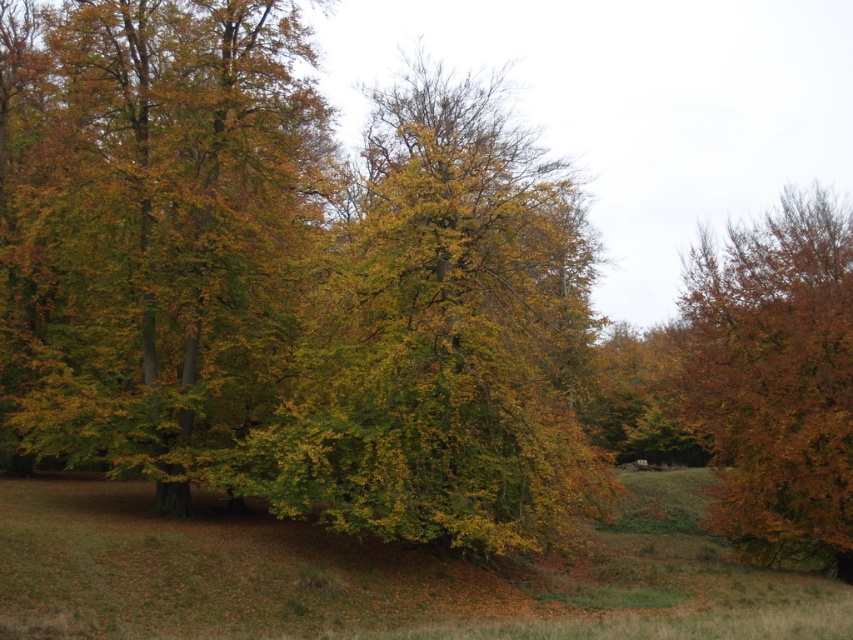
Between point (201, 358) and point (291, 508), which one is positioned in front?

Point (291, 508) is more forward.

Is golden-green leaves at center to the left of green leafy tree at center from the viewer's perspective?

Indeed, golden-green leaves at center is positioned on the left side of green leafy tree at center.

I want to click on golden-green leaves at center, so click(149, 228).

Who is higher up, golden-green leaves at center or brown matte tree at right?

Positioned higher is golden-green leaves at center.

Measure the distance between point [247,381] and camera.

The distance of point [247,381] from camera is 29.77 meters.

Does point (62, 280) come farther from viewer compared to point (744, 518)?

No, it is not.

Identify the location of golden-green leaves at center. Image resolution: width=853 pixels, height=640 pixels. 149,228.

Between green leafy tree at center and brown matte tree at right, which one has less height?

Standing shorter between the two is brown matte tree at right.

Who is higher up, green leafy tree at center or brown matte tree at right?

green leafy tree at center

The width and height of the screenshot is (853, 640). In order to click on green leafy tree at center in this screenshot , I will do `click(444, 339)`.